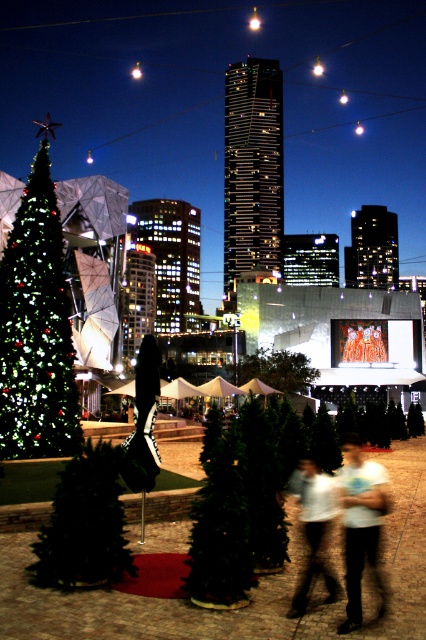
Question: Among these objects, which one is farthest from the camera?

Choices:
 (A) green matte tree at center
 (B) illuminated glossy christmas tree at left

Answer: (A)

Question: Which point appears closest to the camera in this image?

Choices:
 (A) (282, 365)
 (B) (192, 515)
 (C) (362, 477)
 (D) (78, 552)

Answer: (D)

Question: Is illuminated glossy christmas tree at left bigger than white cotton t-shirt at center?

Choices:
 (A) yes
 (B) no

Answer: (A)

Question: Which point is farther to the camera?

Choices:
 (A) (189, 588)
 (B) (92, 532)
 (C) (293, 480)
 (D) (385, 497)

Answer: (C)

Question: Does illuminated glossy christmas tree at left appear under white cotton t-shirt at center?

Choices:
 (A) no
 (B) yes

Answer: (A)

Question: Is white cotton t-shirt at center to the left of white cotton shirt at center from the viewer's perspective?

Choices:
 (A) yes
 (B) no

Answer: (B)